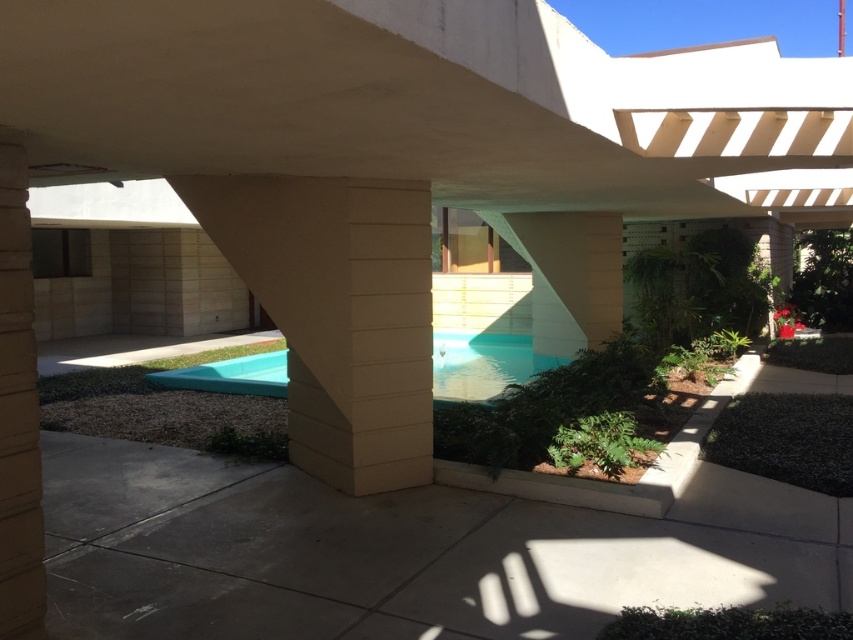
Question: Can you confirm if beige textured pillar at center is positioned above light blue smooth pool at center?

Choices:
 (A) yes
 (B) no

Answer: (A)

Question: Among these objects, which one is farthest from the camera?

Choices:
 (A) beige textured pillar at center
 (B) light blue smooth pool at center

Answer: (B)

Question: Can you confirm if beige textured pillar at center is positioned above light blue smooth pool at center?

Choices:
 (A) yes
 (B) no

Answer: (A)

Question: Which point is closer to the camera taking this photo?

Choices:
 (A) click(x=258, y=284)
 (B) click(x=476, y=339)

Answer: (A)

Question: Is beige textured pillar at center below light blue smooth pool at center?

Choices:
 (A) no
 (B) yes

Answer: (A)

Question: Which point appears farthest from the camera in this image?

Choices:
 (A) (486, 378)
 (B) (392, 403)

Answer: (A)